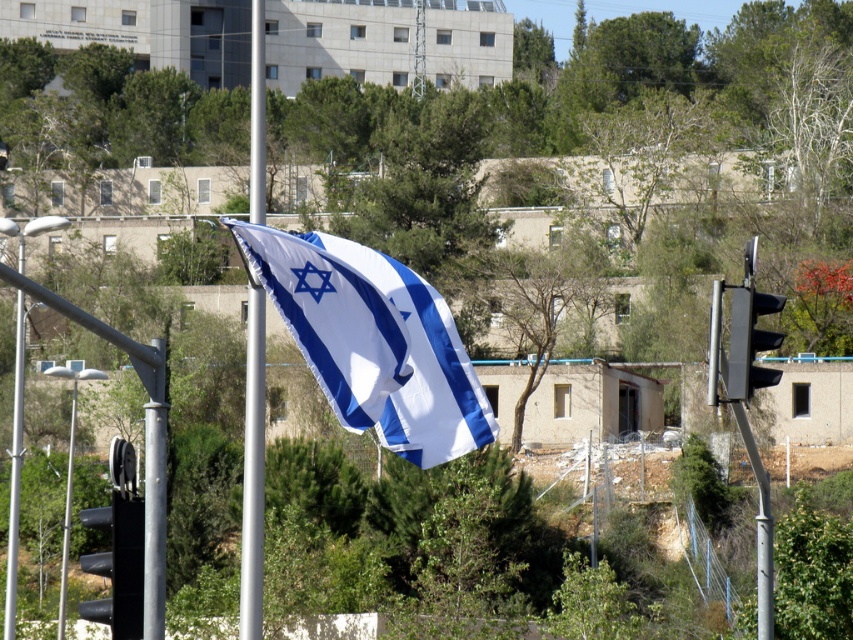
Is metallic silver streetlight at left to the left of metallic gray pole at left from the viewer's perspective?

Indeed, metallic silver streetlight at left is positioned on the left side of metallic gray pole at left.

Does metallic silver streetlight at left lie behind metallic gray pole at left?

No.

The height and width of the screenshot is (640, 853). What do you see at coordinates (15, 470) in the screenshot?
I see `metallic silver streetlight at left` at bounding box center [15, 470].

Identify the location of metallic silver streetlight at left. The height and width of the screenshot is (640, 853). (15, 470).

Is point (252, 353) closer to viewer compared to point (90, 369)?

That is True.

Who is shorter, silver metallic flag pole at center or metallic gray pole at left?

Standing shorter between the two is metallic gray pole at left.

Which is behind, point (244, 412) or point (68, 484)?

The point (244, 412) is behind.

I want to click on silver metallic flag pole at center, so (x=253, y=470).

Is point (322, 346) positioned behind point (61, 554)?

No.

Which is more to the right, white and blue fabric flag at center or metallic gray pole at left?

Positioned to the right is white and blue fabric flag at center.

Locate an element on the screen. Image resolution: width=853 pixels, height=640 pixels. white and blue fabric flag at center is located at coordinates (374, 342).

Where is `white and blue fabric flag at center`? The width and height of the screenshot is (853, 640). white and blue fabric flag at center is located at coordinates (374, 342).